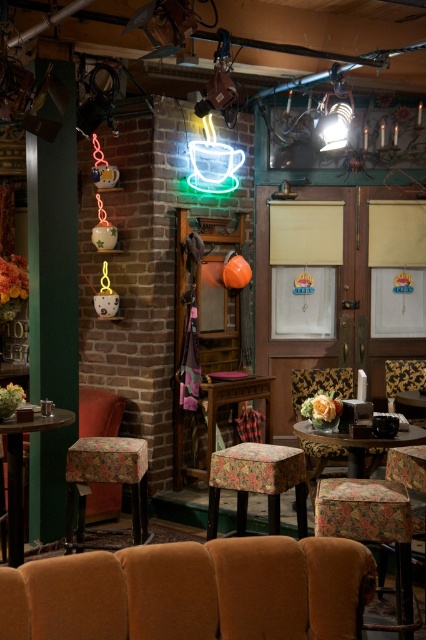
Question: Which object is the farthest from the floral fabric bar stool at center?

Choices:
 (A) floral fabric ottoman at center
 (B) velvet orange armchair at lower center
 (C) neon green glass coffee cup at upper center

Answer: (C)

Question: Is floral fabric table at lower center below velvet-patterned armchair at center?

Choices:
 (A) yes
 (B) no

Answer: (A)

Question: Which of the following is the closest to the observer?

Choices:
 (A) (298, 428)
 (B) (301, 480)
 (C) (201, 385)

Answer: (B)

Question: Which of the following is the farthest from the observer?

Choices:
 (A) floral fabric bar stool at center
 (B) floral fabric ottoman at center
 (C) floral fabric bar stool at lower right
 (D) velvet-patterned armchair at center

Answer: (D)

Question: Can you confirm if floral fabric ottoman at center is bigger than floral fabric table at lower center?

Choices:
 (A) no
 (B) yes

Answer: (B)

Question: Can you confirm if velvet orange armchair at lower center is positioned above floral fabric ottoman at center?

Choices:
 (A) yes
 (B) no

Answer: (B)